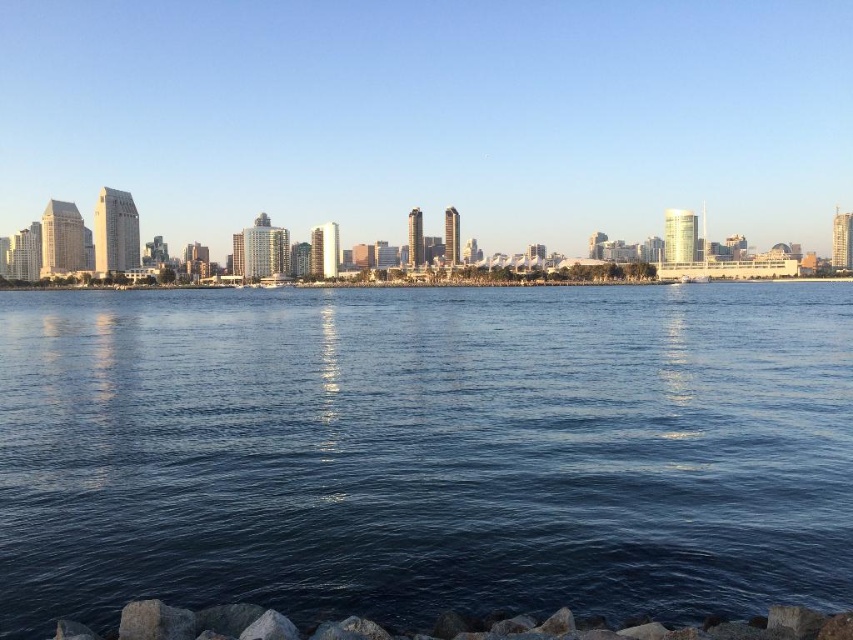
In the scene shown: You are standing at the shoreline looking at the city skyline. There are two points marked in the image. One is at coordinate point (x=338, y=292) and the other is at point (x=379, y=636). Which point is closer to your eyes?

Point (x=338, y=292) is closer to your eyes because it is further to the camera than point (x=379, y=636).

You are a photographer planning to capture the city skyline from the rocky shoreline. You have a camera with a wide angle lens that can capture a maximum width of 10 meters. Given the blue liquid water at center and the gray rock at lower center, which of these two elements can fit entirely within the camera frame if you focus on them individually?

The blue liquid water at center has a greater width than the gray rock at lower center. Since the camera can capture up to 10 meters, both elements might fit, but the question specifies focusing on them individually. However, the description only states the water is wider than the rock. Without exact measurements, we can only confirm the gray rock at lower center will definitely fit if its width is under 10 meters, but the water might exceed the limit. However, since the question asks which can fit entirely